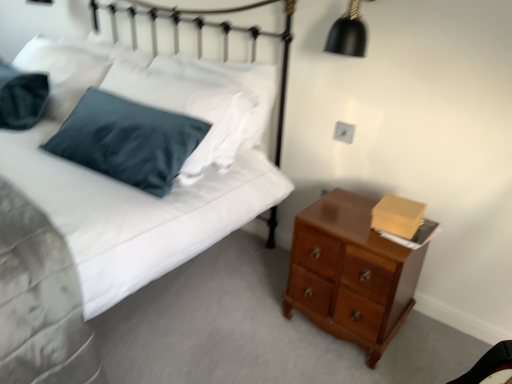
Question: Considering the relative sizes of glossy wood chest of drawers at lower right and black matte lampshade at upper right in the image provided, is glossy wood chest of drawers at lower right smaller than black matte lampshade at upper right?

Choices:
 (A) yes
 (B) no

Answer: (B)

Question: Considering the relative sizes of glossy wood chest of drawers at lower right and black matte lampshade at upper right in the image provided, is glossy wood chest of drawers at lower right taller than black matte lampshade at upper right?

Choices:
 (A) no
 (B) yes

Answer: (B)

Question: Is black matte lampshade at upper right at the back of glossy wood chest of drawers at lower right?

Choices:
 (A) yes
 (B) no

Answer: (B)

Question: Is black matte lampshade at upper right located within glossy wood chest of drawers at lower right?

Choices:
 (A) yes
 (B) no

Answer: (B)

Question: Can you confirm if glossy wood chest of drawers at lower right is bigger than black matte lampshade at upper right?

Choices:
 (A) yes
 (B) no

Answer: (A)

Question: Considering the positions of black matte lampshade at upper right and satin blue pillow at upper left in the image, is black matte lampshade at upper right bigger or smaller than satin blue pillow at upper left?

Choices:
 (A) big
 (B) small

Answer: (B)

Question: Choose the correct answer: Is black matte lampshade at upper right inside satin blue pillow at upper left or outside it?

Choices:
 (A) inside
 (B) outside

Answer: (B)

Question: Considering their positions, is black matte lampshade at upper right located in front of or behind satin blue pillow at upper left?

Choices:
 (A) behind
 (B) front

Answer: (B)

Question: Looking at their shapes, would you say black matte lampshade at upper right is wider or thinner than satin blue pillow at upper left?

Choices:
 (A) wide
 (B) thin

Answer: (B)

Question: Considering their positions, is glossy wood chest of drawers at lower right located in front of or behind satin blue pillow at upper left?

Choices:
 (A) front
 (B) behind

Answer: (A)

Question: Is glossy wood chest of drawers at lower right inside or outside of satin blue pillow at upper left?

Choices:
 (A) outside
 (B) inside

Answer: (A)

Question: Considering the positions of glossy wood chest of drawers at lower right and satin blue pillow at upper left in the image, is glossy wood chest of drawers at lower right wider or thinner than satin blue pillow at upper left?

Choices:
 (A) thin
 (B) wide

Answer: (B)

Question: From the image's perspective, is glossy wood chest of drawers at lower right positioned above or below satin blue pillow at upper left?

Choices:
 (A) above
 (B) below

Answer: (B)

Question: Is satin blue pillow at upper left to the left or to the right of glossy wood chest of drawers at lower right in the image?

Choices:
 (A) left
 (B) right

Answer: (A)

Question: Does point (274, 152) appear closer or farther from the camera than point (284, 314)?

Choices:
 (A) farther
 (B) closer

Answer: (A)